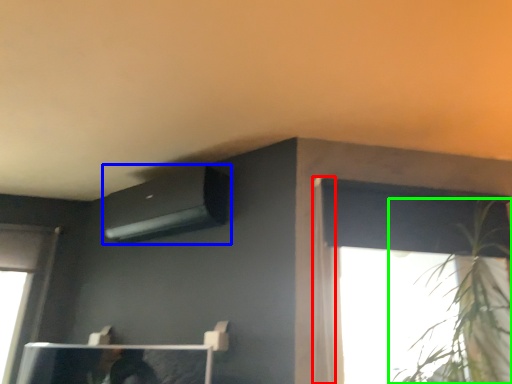
Question: Which is farther away from curtain (highlighted by a red box)? air conditioning (highlighted by a blue box) or houseplant (highlighted by a green box)?

Choices:
 (A) air conditioning
 (B) houseplant

Answer: (A)